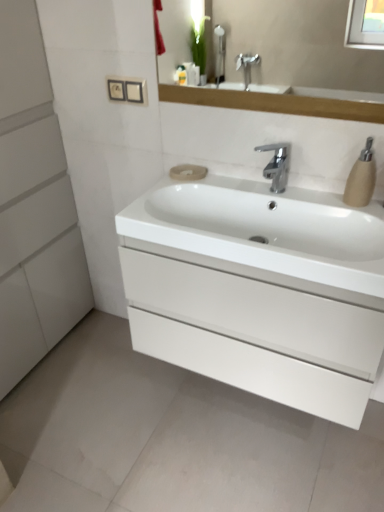
Identify the location of free space above white glossy drawer at center (from a real-world perspective). (273, 225).